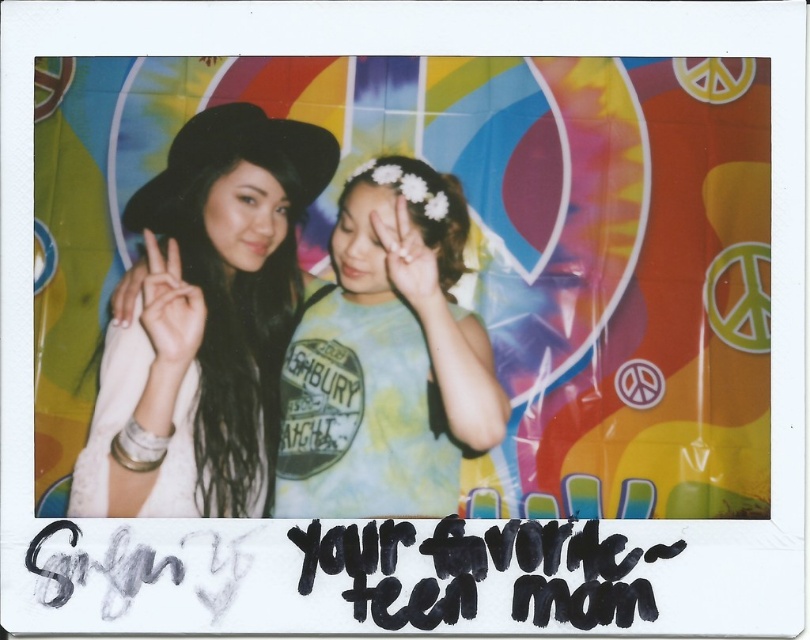
Question: In this image, where is tie-dye fabric shirt at center located relative to matte black hand at center?

Choices:
 (A) above
 (B) below

Answer: (B)

Question: Is matte black hand at center closer to camera compared to white matte hand at center?

Choices:
 (A) yes
 (B) no

Answer: (A)

Question: Which of the following is the farthest from the observer?

Choices:
 (A) white matte hand at center
 (B) matte black hat at left
 (C) matte black hand at center

Answer: (A)

Question: Considering the relative positions of tie-dye fabric shirt at center and white matte hand at center in the image provided, where is tie-dye fabric shirt at center located with respect to white matte hand at center?

Choices:
 (A) right
 (B) left

Answer: (B)

Question: Among these points, which one is farthest from the camera?

Choices:
 (A) (151, 344)
 (B) (391, 266)
 (C) (202, 465)

Answer: (B)

Question: Which point is closer to the camera?

Choices:
 (A) matte black hand at center
 (B) matte black hat at left

Answer: (B)